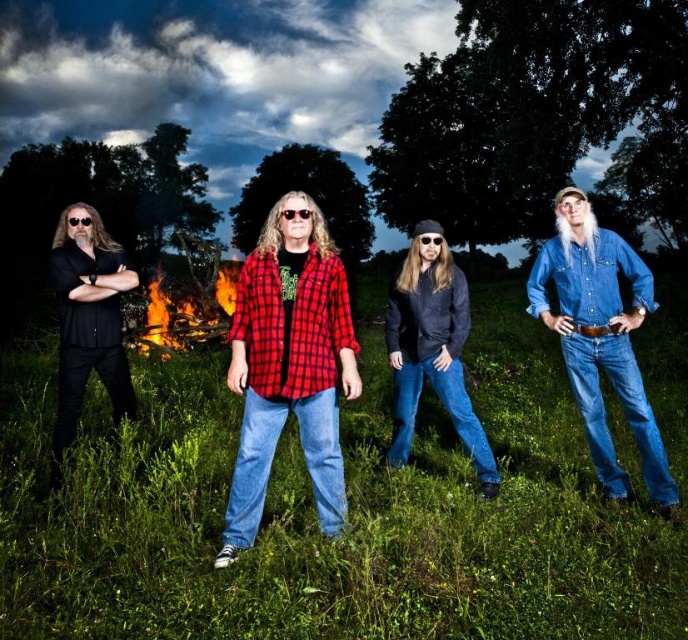
Question: Which is nearer to the green grass at center?

Choices:
 (A) black matte shirt at left
 (B) flaming wood at center
 (C) red plaid flannel shirt at center

Answer: (A)

Question: Can you confirm if denim shirt at center is bigger than black matte shirt at left?

Choices:
 (A) no
 (B) yes

Answer: (A)

Question: Does black matte shirt at left have a greater width compared to flaming wood at center?

Choices:
 (A) no
 (B) yes

Answer: (A)

Question: Which object is farther from the camera taking this photo?

Choices:
 (A) black matte shirt at left
 (B) green grass at center
 (C) denim shirt at center

Answer: (C)

Question: Can you confirm if red plaid flannel shirt at center is smaller than flaming wood at center?

Choices:
 (A) no
 (B) yes

Answer: (B)

Question: Which object appears closest to the camera in this image?

Choices:
 (A) red plaid flannel shirt at center
 (B) flaming wood at center

Answer: (A)